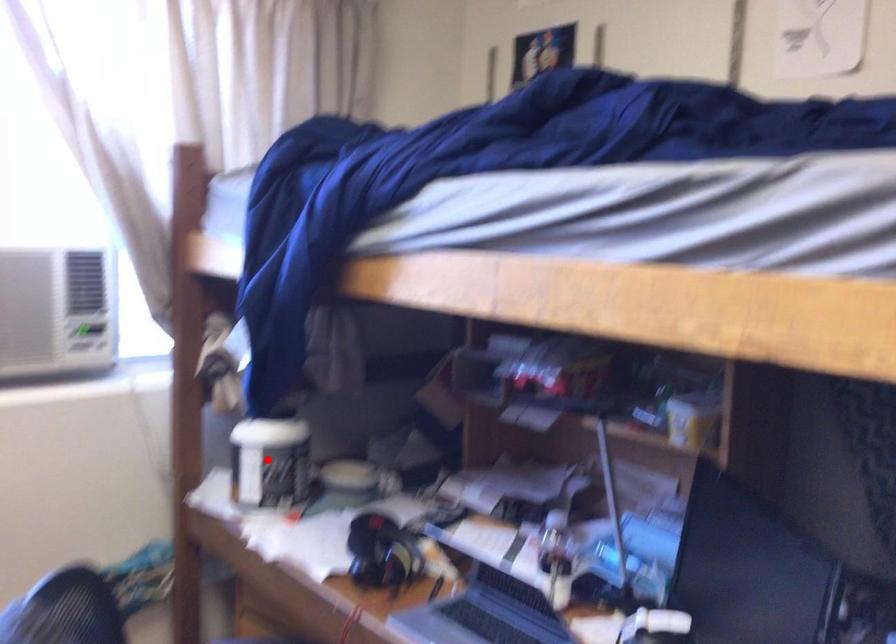
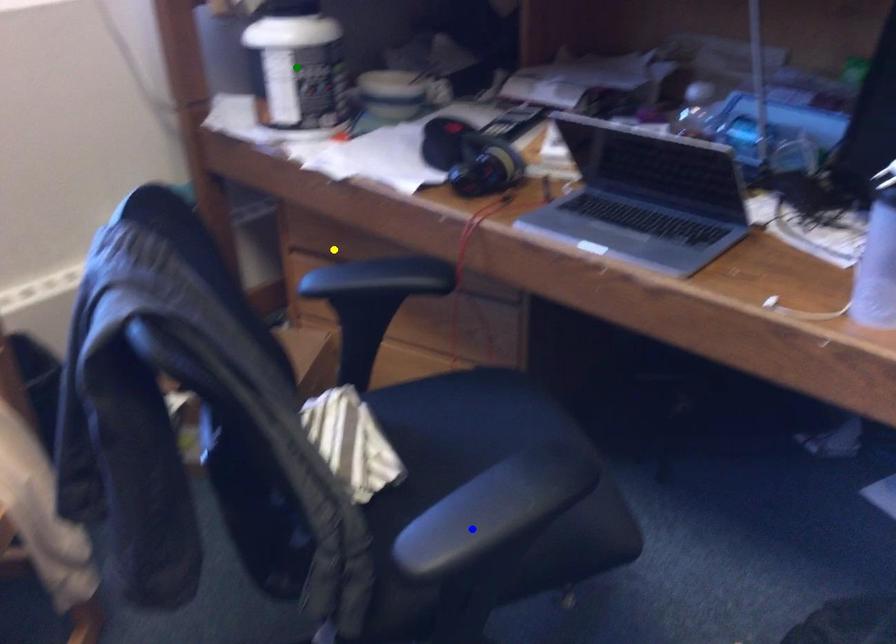
Question: I am providing you with two images of the same scene from different viewpoints. A red point is marked on the first image. You are given multiple points on the second image. Which spot in image 2 lines up with the point in image 1?

Choices:
 (A) green point
 (B) yellow point
 (C) blue point

Answer: (A)